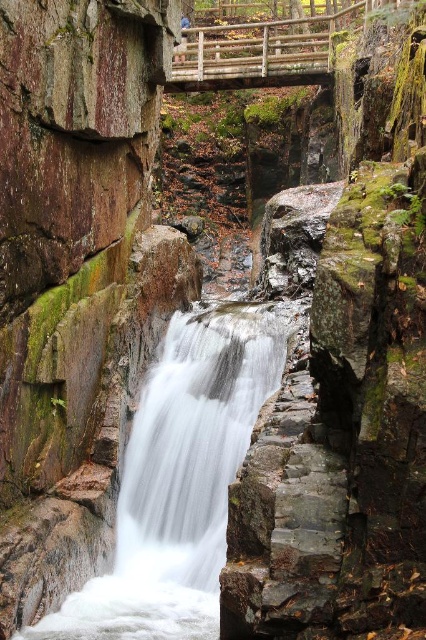
Between point (196, 515) and point (348, 4), which one is positioned behind?

Positioned behind is point (348, 4).

Which of these two, white smooth water at center or wooden bridge at upper center, stands taller?

wooden bridge at upper center is taller.

Is point (155, 563) closer to camera compared to point (313, 38)?

Yes.

Locate an element on the screen. white smooth water at center is located at coordinates (180, 481).